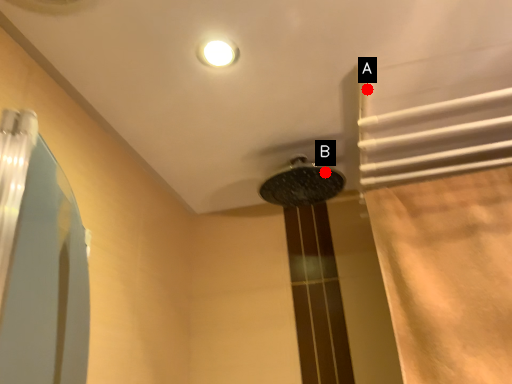
Question: Two points are circled on the image, labeled by A and B beside each circle. Among these points, which one is farthest from the camera?

Choices:
 (A) A is further
 (B) B is further

Answer: (B)